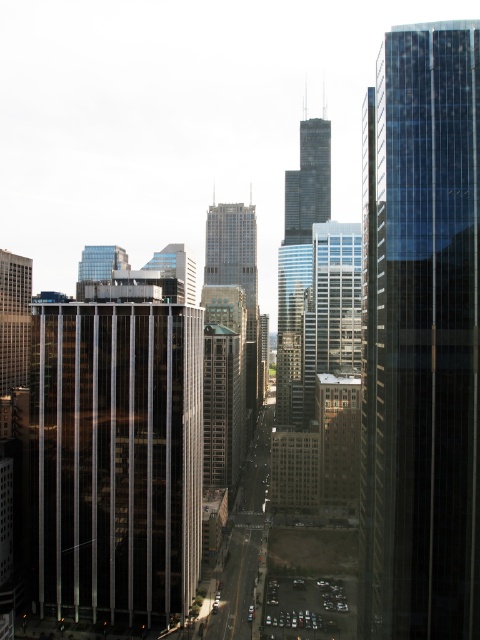
Is glassy steel skyscraper at center shorter than matte glass building at center?

In fact, glassy steel skyscraper at center may be taller than matte glass building at center.

Based on the photo, can you confirm if glassy steel skyscraper at center is taller than matte glass building at center?

Yes, glassy steel skyscraper at center is taller than matte glass building at center.

Identify the location of glassy steel skyscraper at center. (238, 278).

This screenshot has height=640, width=480. I want to click on glassy steel skyscraper at center, so click(x=238, y=278).

Does transparent glass skyscraper at right have a greater height compared to clear glass skyscraper at center?

Correct, transparent glass skyscraper at right is much taller as clear glass skyscraper at center.

At what (x,y) coordinates should I click in order to perform the action: click on transparent glass skyscraper at right. Please return your answer as a coordinate pair (x, y). The height and width of the screenshot is (640, 480). Looking at the image, I should click on (420, 337).

Identify the location of transparent glass skyscraper at right. The height and width of the screenshot is (640, 480). (420, 337).

The height and width of the screenshot is (640, 480). What are the coordinates of `transparent glass skyscraper at right` in the screenshot? It's located at (420, 337).

Looking at this image, who is positioned more to the right, shiny glass skyscraper at center or clear glass skyscraper at center?

Positioned to the right is clear glass skyscraper at center.

From the picture: Does shiny glass skyscraper at center appear on the right side of clear glass skyscraper at center?

In fact, shiny glass skyscraper at center is to the left of clear glass skyscraper at center.

Find the location of a particular element. shiny glass skyscraper at center is located at coordinates (116, 460).